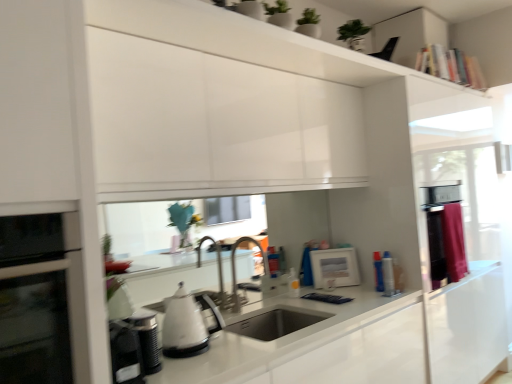
Question: Which direction should I rotate to look at white glossy picture frame at center, which ranks as the 1th appliance in back-to-front order?

Choices:
 (A) left
 (B) right

Answer: (B)

Question: Is satin nickel faucet at center not inside silver metallic canister at right, which is counted as the fourth appliance, starting from the left?

Choices:
 (A) no
 (B) yes

Answer: (B)

Question: Can you confirm if satin nickel faucet at center is thinner than silver metallic canister at right, acting as the first appliance starting from the right?

Choices:
 (A) no
 (B) yes

Answer: (A)

Question: Is satin nickel faucet at center taller than silver metallic canister at right, which is counted as the fourth appliance, starting from the left?

Choices:
 (A) yes
 (B) no

Answer: (A)

Question: Is satin nickel faucet at center positioned before silver metallic canister at right, the 2th appliance viewed from the back?

Choices:
 (A) yes
 (B) no

Answer: (A)

Question: From the image's perspective, is satin nickel faucet at center under silver metallic canister at right, which is counted as the fourth appliance, starting from the left?

Choices:
 (A) yes
 (B) no

Answer: (B)

Question: From the image's perspective, is satin nickel faucet at center on top of silver metallic canister at right, acting as the first appliance starting from the right?

Choices:
 (A) no
 (B) yes

Answer: (B)

Question: Is white glossy kettle at lower center, which appears as the third appliance when viewed from the back, positioned far away from satin nickel faucet at center?

Choices:
 (A) yes
 (B) no

Answer: (B)

Question: Does white glossy kettle at lower center, which appears as the 3th appliance when viewed from the right, have a greater height compared to satin nickel faucet at center?

Choices:
 (A) yes
 (B) no

Answer: (B)

Question: Would you say white glossy kettle at lower center, arranged as the second appliance when viewed from the front, is outside satin nickel faucet at center?

Choices:
 (A) no
 (B) yes

Answer: (B)

Question: Does white glossy kettle at lower center, which appears as the third appliance when viewed from the back, come behind satin nickel faucet at center?

Choices:
 (A) yes
 (B) no

Answer: (B)

Question: Can you confirm if white glossy kettle at lower center, acting as the second appliance starting from the left, is bigger than satin nickel faucet at center?

Choices:
 (A) no
 (B) yes

Answer: (A)

Question: From a real-world perspective, is white glossy kettle at lower center, arranged as the second appliance when viewed from the front, on satin nickel faucet at center?

Choices:
 (A) yes
 (B) no

Answer: (B)

Question: From the image's perspective, does white glossy kettle at lower left, the first appliance in the front-to-back sequence, appear higher than maroon fabric curtain at right?

Choices:
 (A) no
 (B) yes

Answer: (A)